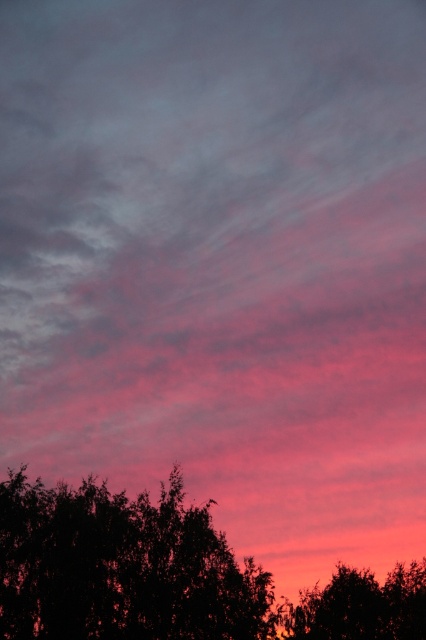
Which of these two, silhouette leafy tree at lower center or silhouette tree at lower right, stands taller?

silhouette tree at lower right is taller.

Is silhouette leafy tree at lower center positioned at the back of silhouette tree at lower right?

No, it is in front of silhouette tree at lower right.

Is point (137, 515) less distant than point (360, 616)?

Yes, it is in front of point (360, 616).

Find the location of a particular element. The width and height of the screenshot is (426, 640). silhouette leafy tree at lower center is located at coordinates (120, 566).